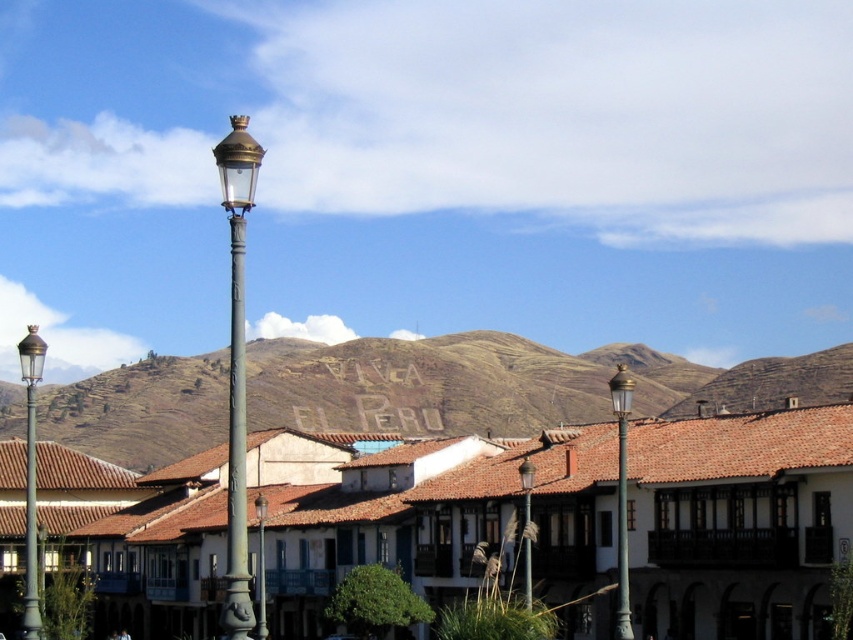
You are an architect designing a new town square and want to ensure the bronze textured street light at center is proportionally balanced with the brown rocky mountain at center. Based on their widths, which object should be placed farther away to maintain visual harmony?

The bronze textured street light at center should be placed farther away because the brown rocky mountain at center is wider, so positioning the narrower street light further back will help balance their visual sizes in the composition.

You are standing in the town square and see the brown rocky mountain at center and the bronze textured street light at center. Which object is positioned to the right when facing the scene?

The brown rocky mountain at center is positioned to the right of the bronze textured street light at center.

You are a town planner assessing the width of the street lights for maintenance. Which street light has a smaller width between the green polished metal street light at right and the bronze textured street light at center?

The green polished metal street light at right has a lesser width compared to the bronze textured street light at center, so it is the smaller one.